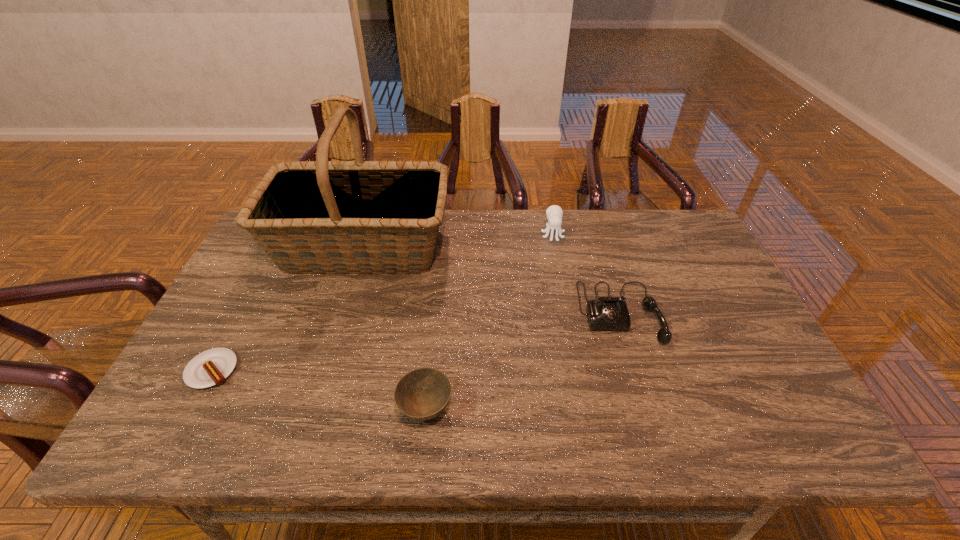
At what (x,y) coordinates should I click in order to perform the action: click on blank space at the far right corner. Please return your answer as a coordinate pair (x, y). Image resolution: width=960 pixels, height=540 pixels. Looking at the image, I should click on (650, 222).

Where is `vacant space at the near right corner`? The image size is (960, 540). vacant space at the near right corner is located at coordinates point(780,425).

The height and width of the screenshot is (540, 960). I want to click on free spot between the shortest object and the octopus, so click(x=382, y=302).

I want to click on unoccupied position between the second shortest object and the telephone, so click(x=522, y=361).

Image resolution: width=960 pixels, height=540 pixels. Find the location of `free point between the bowl and the shortest object`. free point between the bowl and the shortest object is located at coordinates (319, 390).

Find the location of a particular element. free spot between the telephone and the tallest object is located at coordinates (492, 280).

Locate an element on the screen. This screenshot has width=960, height=540. empty location between the shortest object and the second shortest object is located at coordinates (319, 390).

This screenshot has height=540, width=960. In order to click on vacant area that lies between the octopus and the sausage in this screenshot , I will do `click(382, 302)`.

The height and width of the screenshot is (540, 960). What are the coordinates of `free point between the telephone and the bowl` in the screenshot? It's located at (522, 361).

Find the location of `empty space that is in between the second shortest object and the tallest object`. empty space that is in between the second shortest object and the tallest object is located at coordinates (395, 328).